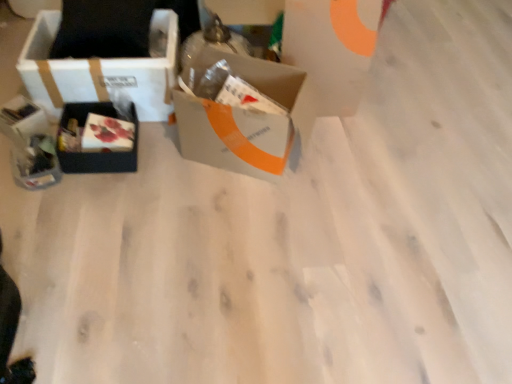
This screenshot has height=384, width=512. Find the location of `unoccupied region to the right of white cardboard box at upper center`. unoccupied region to the right of white cardboard box at upper center is located at coordinates (389, 102).